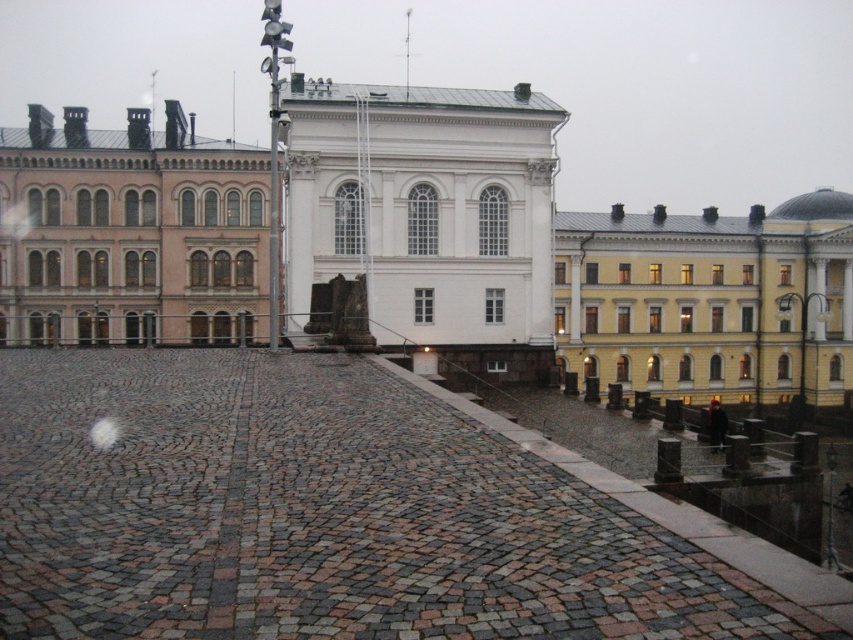
Is point (251, 454) more distant than point (538, 240)?

No, it is not.

Which is below, brown cobblestone courtyard at center or white smooth stone building at center?

brown cobblestone courtyard at center is below.

Who is more forward, (x=177, y=497) or (x=389, y=182)?

Point (x=177, y=497) is more forward.

You are a GUI agent. You are given a task and a screenshot of the screen. Output one action in this format:
    pyautogui.click(x=<x>, y=<y>)
    Task: Click on the brown cobblestone courtyard at center
    This screenshot has height=640, width=853.
    Given the screenshot: What is the action you would take?
    pyautogui.click(x=335, y=515)

Is white smooth stone building at center taller than pink stone building at left?

Correct, white smooth stone building at center is much taller as pink stone building at left.

Can you confirm if white smooth stone building at center is smaller than pink stone building at left?

Yes.

Is point (531, 300) closer to camera compared to point (144, 282)?

Yes, point (531, 300) is closer to viewer.

Where is `white smooth stone building at center`? white smooth stone building at center is located at coordinates (427, 216).

Does white smooth stone building at center have a larger size compared to yellow matte building at upper right?

No, white smooth stone building at center is not bigger than yellow matte building at upper right.

Does white smooth stone building at center appear over yellow matte building at upper right?

Indeed, white smooth stone building at center is positioned over yellow matte building at upper right.

This screenshot has width=853, height=640. I want to click on white smooth stone building at center, so click(427, 216).

This screenshot has width=853, height=640. What are the coordinates of `white smooth stone building at center` in the screenshot? It's located at (427, 216).